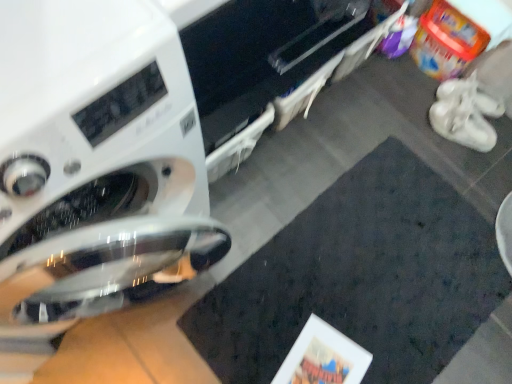
At what (x,y) coordinates should I click in order to perform the action: click on free point above dark matte mat at center (from a real-world perspective). Please return your answer as a coordinate pair (x, y). Looking at the image, I should click on (366, 283).